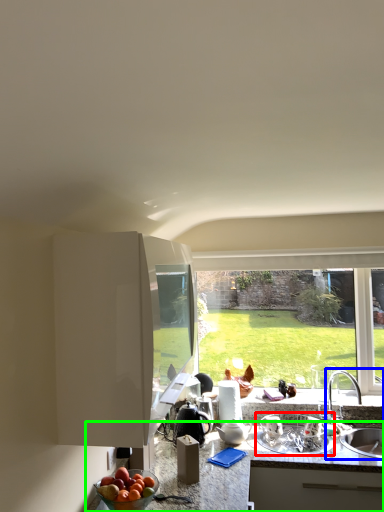
Question: Based on their relative distances, which object is farther from appliance (highlighted by a red box)? Choose from sink (highlighted by a blue box) and countertop (highlighted by a green box).

Choices:
 (A) sink
 (B) countertop

Answer: (A)